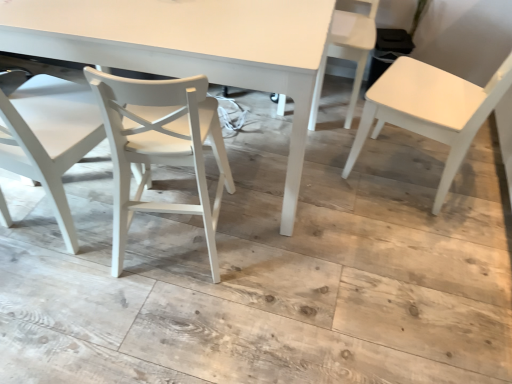
Find the location of a particular element. This screenshot has width=512, height=384. vacant area situated below white matte chair at left, marked as the first chair in a left-to-right arrangement (from a real-world perspective) is located at coordinates (56, 221).